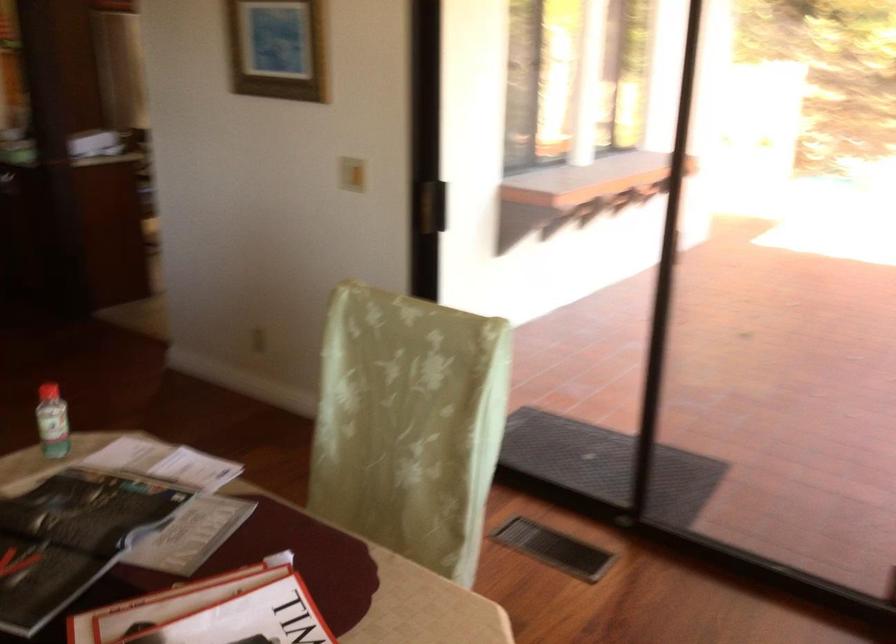
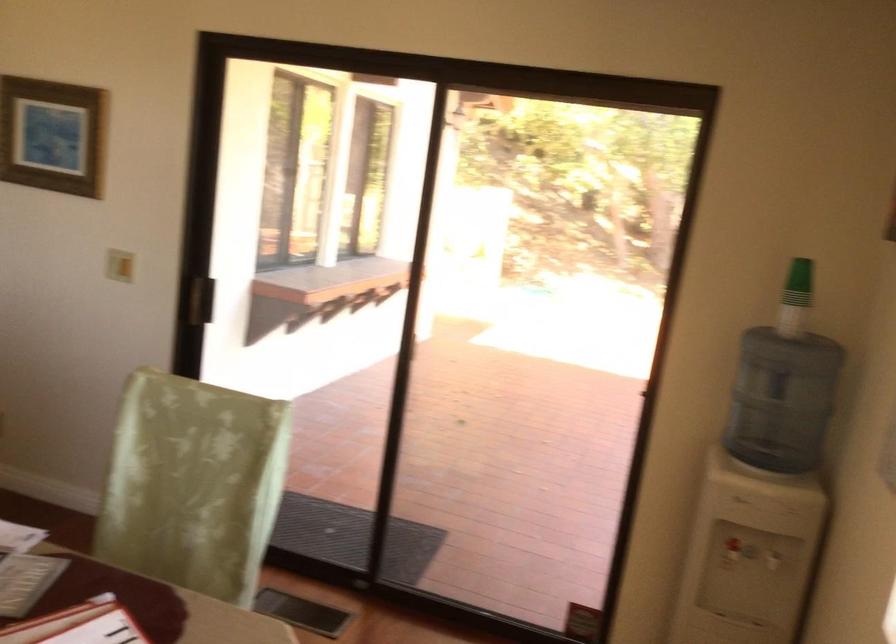
In the second image, find the point that corresponds to point (444, 210) in the first image.

(201, 299)